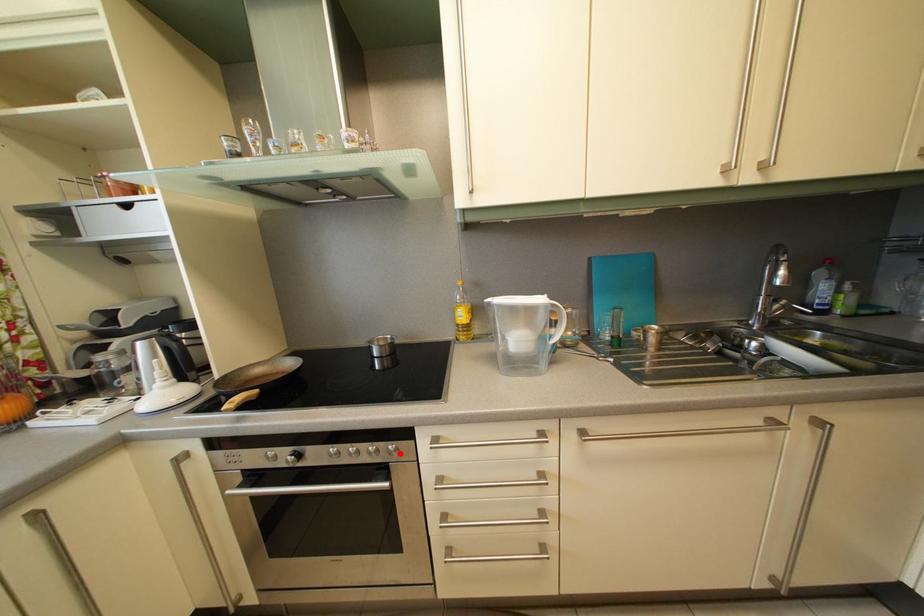
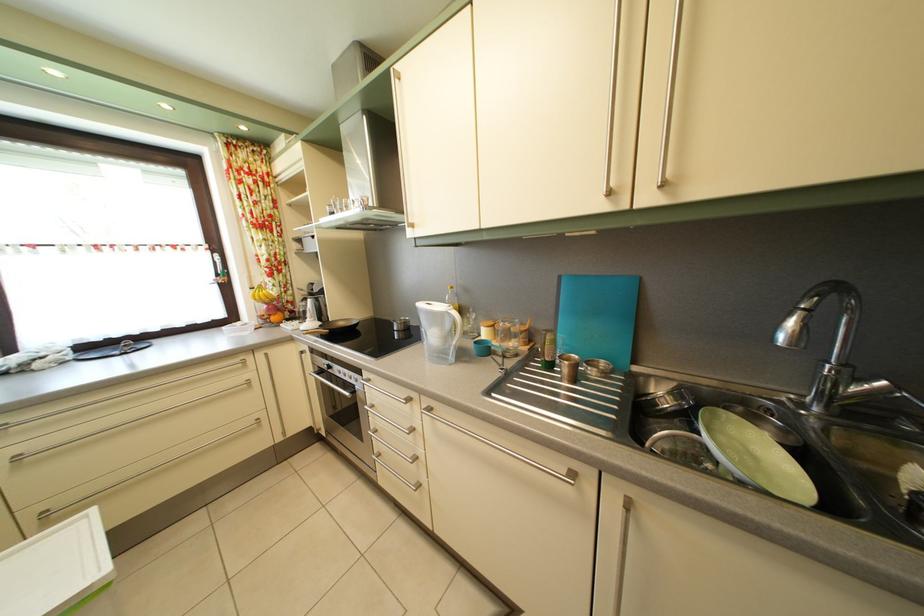
Locate, in the second image, the point that corresponds to the highlighted location in the first image.

(365, 384)